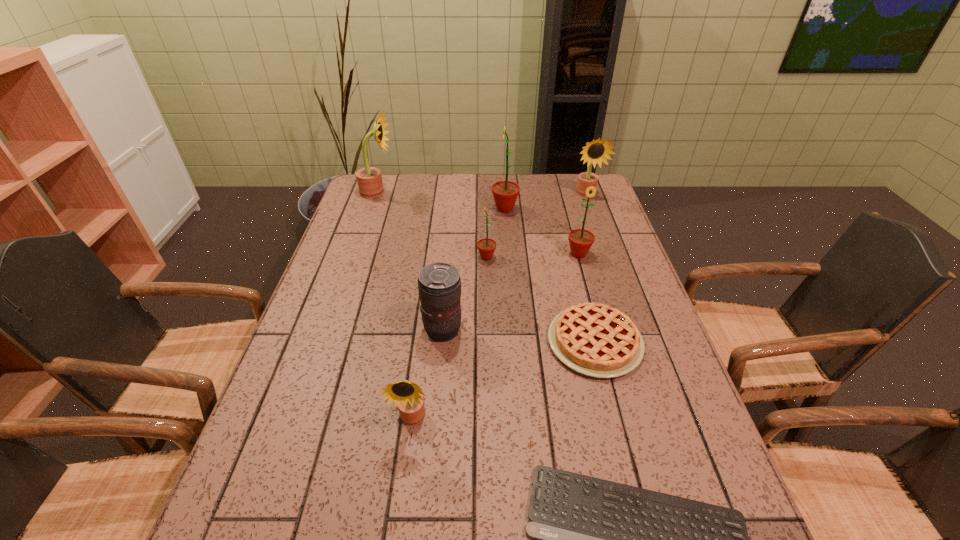
I want to click on free location that satisfies the following two spatial constraints: 1. on the face of the biggest green sunflower; 2. on the right side of the second shortest object, so click(516, 342).

At what (x,y) coordinates should I click in order to perform the action: click on vacant space that satisfies the following two spatial constraints: 1. on the face of the rightmost green sunflower; 2. on the side of the telephoto lens where the control switches are located. Please return your answer as a coordinate pair (x, y). The width and height of the screenshot is (960, 540). Looking at the image, I should click on (599, 330).